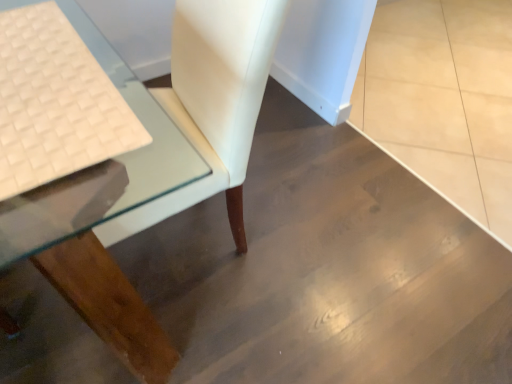
You are a GUI agent. You are given a task and a screenshot of the screen. Output one action in this format:
    pyautogui.click(x=<x>, y=<y>)
    Task: Click on the vacant space situated above white woven fabric at left (from a real-world perspective)
    This screenshot has height=384, width=512.
    Given the screenshot: What is the action you would take?
    pyautogui.click(x=37, y=92)